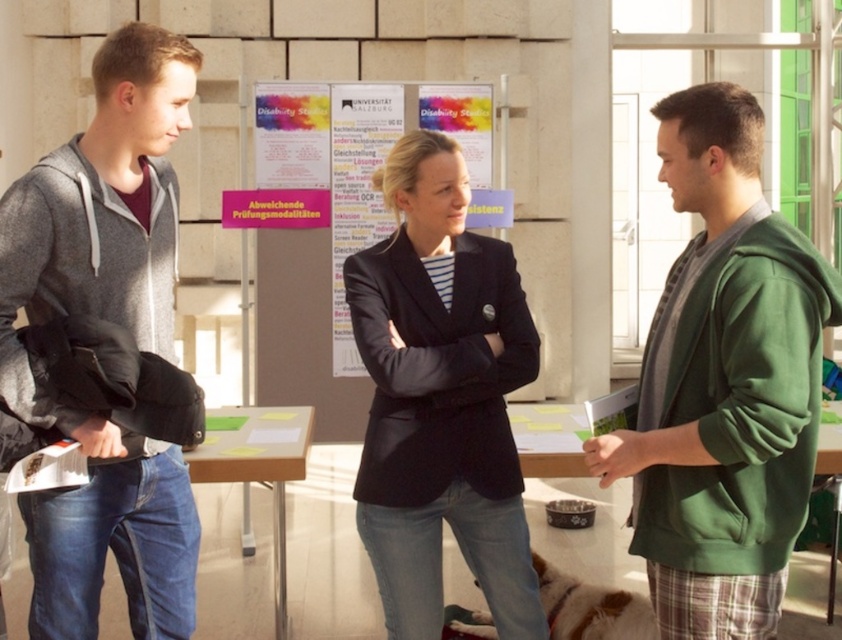
You are a student trying to borrow a jacket from the group. The green fleece jacket at right and the dark blue blazer at center are both available. Which jacket is positioned more to the east side of the room?

The green fleece jacket at right is positioned more to the east side of the room because it is to the right of the dark blue blazer at center, and the windows are on the right side implying east direction.

You are standing in the scene and want to take a photo of the point at coordinates (715, 243). The camera you have can only focus on objects within 2 meters. Will the point be in focus?

The point at coordinates (715, 243) is 2.39 meters from the camera, which is beyond the 2 meter focus range. The point will not be in focus.